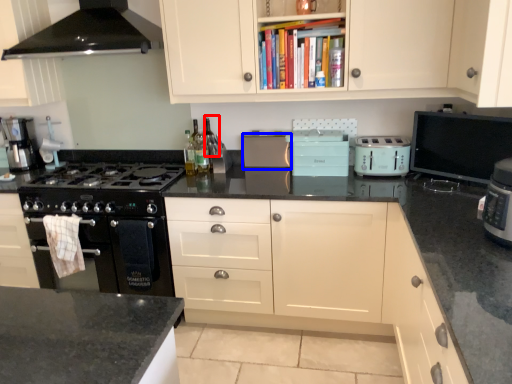
Question: Which object appears farthest to the camera in this image, wine bottle (highlighted by a red box) or appliance (highlighted by a blue box)?

Choices:
 (A) wine bottle
 (B) appliance

Answer: (A)